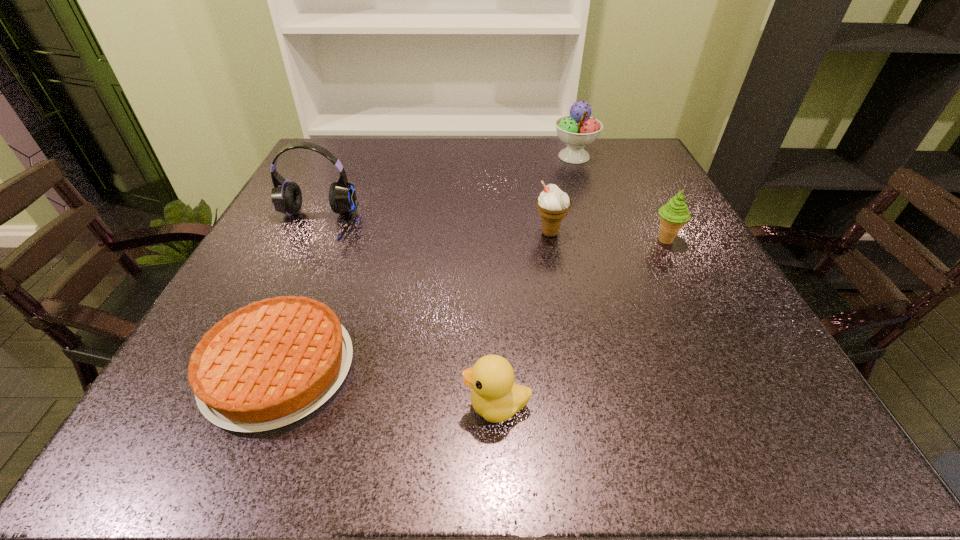
This screenshot has width=960, height=540. I want to click on free space located 0.360m on the back of the leftmost icecream, so click(x=534, y=149).

Locate an element on the screen. free region located 0.380m on the front of the rightmost object is located at coordinates (756, 417).

The width and height of the screenshot is (960, 540). Find the location of `vacant point located 0.200m on the face of the duck`. vacant point located 0.200m on the face of the duck is located at coordinates (324, 406).

This screenshot has height=540, width=960. I want to click on vacant area situated on the face of the duck, so click(324, 406).

Identify the location of vacant region located on the face of the duck. (275, 406).

This screenshot has width=960, height=540. What are the coordinates of `vacant point located 0.090m on the back of the pie` in the screenshot? It's located at (316, 280).

Find the location of a particular element. Image resolution: width=960 pixels, height=540 pixels. object present at the far edge is located at coordinates pyautogui.click(x=577, y=130).

The image size is (960, 540). I want to click on duck located in the near edge section of the desktop, so click(495, 396).

The height and width of the screenshot is (540, 960). Find the location of `pie that is at the near edge`. pie that is at the near edge is located at coordinates (271, 363).

I want to click on headset that is at the left edge, so click(x=286, y=196).